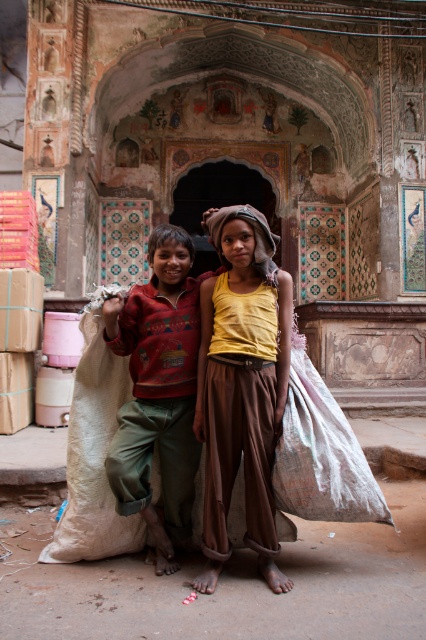
Which is behind, point (203, 332) or point (195, 390)?

The point (203, 332) is behind.

Does yellow cotton shirt at center have a larger size compared to red sweater at center?

No, yellow cotton shirt at center is not bigger than red sweater at center.

Is point (241, 260) positioned in front of point (161, 248)?

Yes, it is.

The image size is (426, 640). In order to click on yellow cotton shirt at center in this screenshot , I will do `click(241, 387)`.